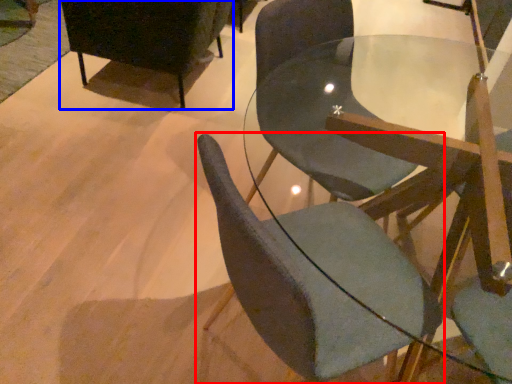
Question: Which point is closer to the camera, chair (highlighted by a red box) or chair (highlighted by a blue box)?

Choices:
 (A) chair
 (B) chair

Answer: (A)